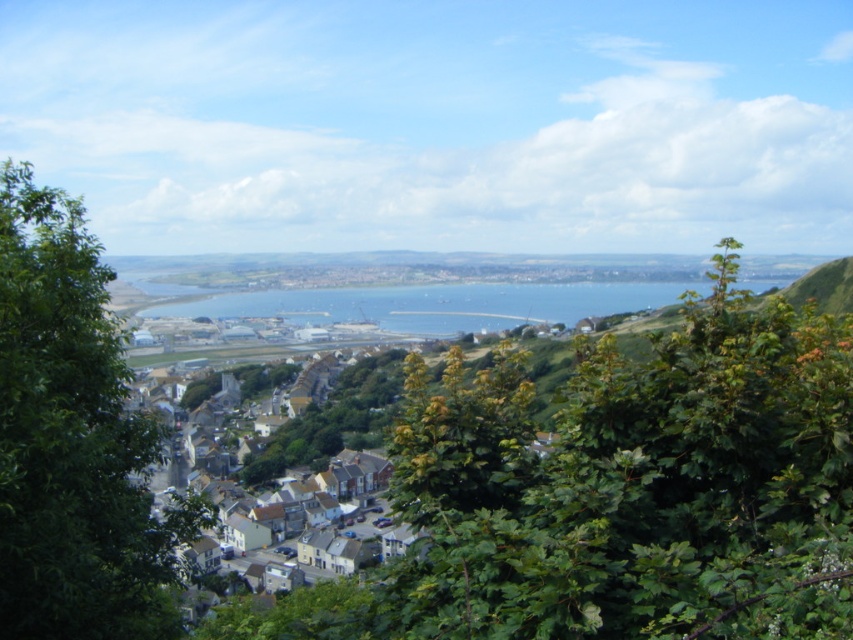
You are standing in the coastal town and want to take a photo of both the green leafy tree at left and the white matte houses at center. Which object should you adjust your camera focus to first to ensure both are in the frame?

Since the green leafy tree at left is closer to the viewer than the white matte houses at center, you should focus on the green leafy tree at left first to ensure both are in the frame.

You are standing in the coastal town and want to take a photo of the white matte houses at center without the green leafy tree at left blocking the view. Which direction should you move to ensure the tree is no longer in front of the houses?

Move to the left side so that the green leafy tree at left is no longer blocking the white matte houses at center.